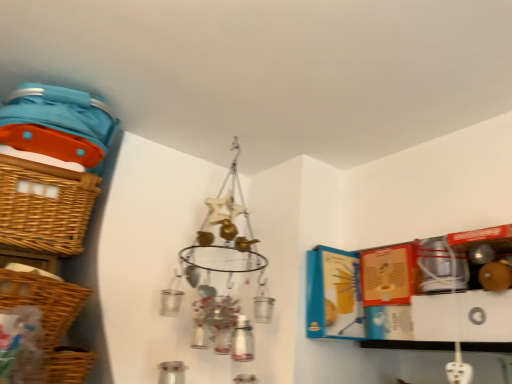
Question: Does woven brown basket at lower left, the first basket in the bottom-to-top sequence, touch woven brown basket at left, marked as the first basket in a top-to-bottom arrangement?

Choices:
 (A) no
 (B) yes

Answer: (A)

Question: Considering the relative sizes of woven brown basket at lower left, the first basket in the bottom-to-top sequence, and woven brown basket at left, marked as the first basket in a top-to-bottom arrangement, in the image provided, is woven brown basket at lower left, the first basket in the bottom-to-top sequence, smaller than woven brown basket at left, marked as the first basket in a top-to-bottom arrangement,?

Choices:
 (A) yes
 (B) no

Answer: (A)

Question: Are woven brown basket at lower left, the first basket in the bottom-to-top sequence, and woven brown basket at left, which is the third basket from bottom to top, far apart?

Choices:
 (A) no
 (B) yes

Answer: (A)

Question: Can you confirm if woven brown basket at lower left, the first basket in the bottom-to-top sequence, is thinner than woven brown basket at left, marked as the first basket in a top-to-bottom arrangement?

Choices:
 (A) yes
 (B) no

Answer: (A)

Question: Considering the relative sizes of woven brown basket at lower left, which is the 3th basket from top to bottom, and woven brown basket at left, marked as the first basket in a top-to-bottom arrangement, in the image provided, is woven brown basket at lower left, which is the 3th basket from top to bottom, shorter than woven brown basket at left, marked as the first basket in a top-to-bottom arrangement,?

Choices:
 (A) yes
 (B) no

Answer: (A)

Question: Is point (80, 187) closer or farther from the camera than point (49, 364)?

Choices:
 (A) closer
 (B) farther

Answer: (B)

Question: From the image's perspective, is woven brown basket at left, which is the third basket from bottom to top, above or below woven brown basket at lower left, which is the 3th basket from top to bottom?

Choices:
 (A) below
 (B) above

Answer: (B)

Question: Is woven brown basket at left, marked as the first basket in a top-to-bottom arrangement, in front of or behind woven brown basket at lower left, which is the 3th basket from top to bottom, in the image?

Choices:
 (A) behind
 (B) front

Answer: (A)

Question: From a real-world perspective, is woven brown basket at left, marked as the first basket in a top-to-bottom arrangement, positioned above or below woven brown basket at lower left, which is the 3th basket from top to bottom?

Choices:
 (A) above
 (B) below

Answer: (A)

Question: From their relative heights in the image, would you say woven brown basket at lower left, which is the 3th basket from top to bottom, is taller or shorter than woven brown basket at left, placed as the second basket when sorted from top to bottom?

Choices:
 (A) short
 (B) tall

Answer: (A)

Question: Is woven brown basket at lower left, the first basket in the bottom-to-top sequence, wider or thinner than woven brown basket at left, placed as the second basket when sorted from top to bottom?

Choices:
 (A) wide
 (B) thin

Answer: (A)

Question: Does point (49, 374) appear closer or farther from the camera than point (74, 299)?

Choices:
 (A) closer
 (B) farther

Answer: (B)

Question: Is woven brown basket at lower left, which is the 3th basket from top to bottom, spatially inside woven brown basket at left, the second basket when ordered from bottom to top, or outside of it?

Choices:
 (A) inside
 (B) outside

Answer: (B)

Question: Based on their sizes in the image, would you say woven brown basket at left, the second basket when ordered from bottom to top, is bigger or smaller than woven brown basket at left, which is the third basket from bottom to top?

Choices:
 (A) big
 (B) small

Answer: (B)

Question: Is woven brown basket at left, the second basket when ordered from bottom to top, in front of or behind woven brown basket at left, marked as the first basket in a top-to-bottom arrangement, in the image?

Choices:
 (A) behind
 (B) front

Answer: (B)